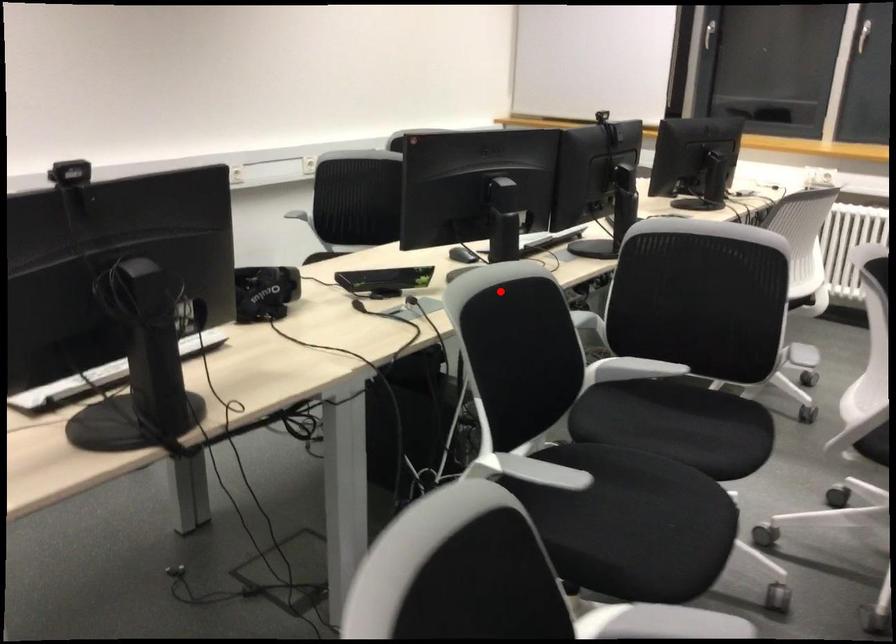
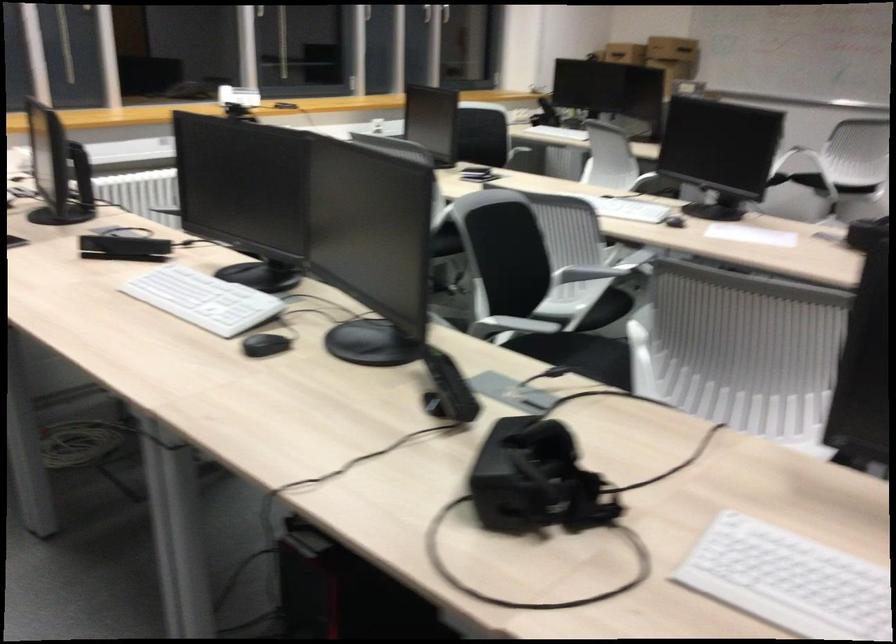
The point at the highlighted location is marked in the first image. Where is the corresponding point in the second image?

(734, 277)